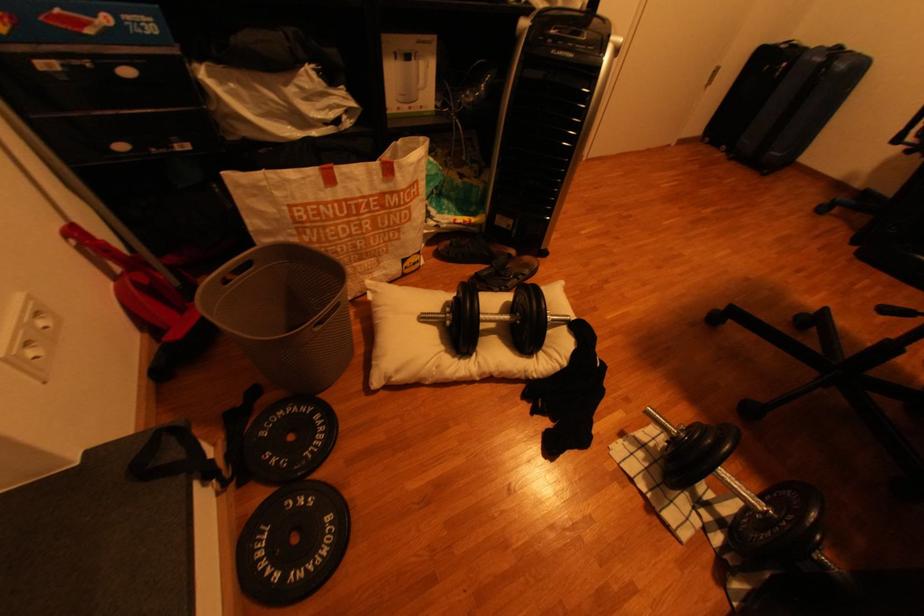
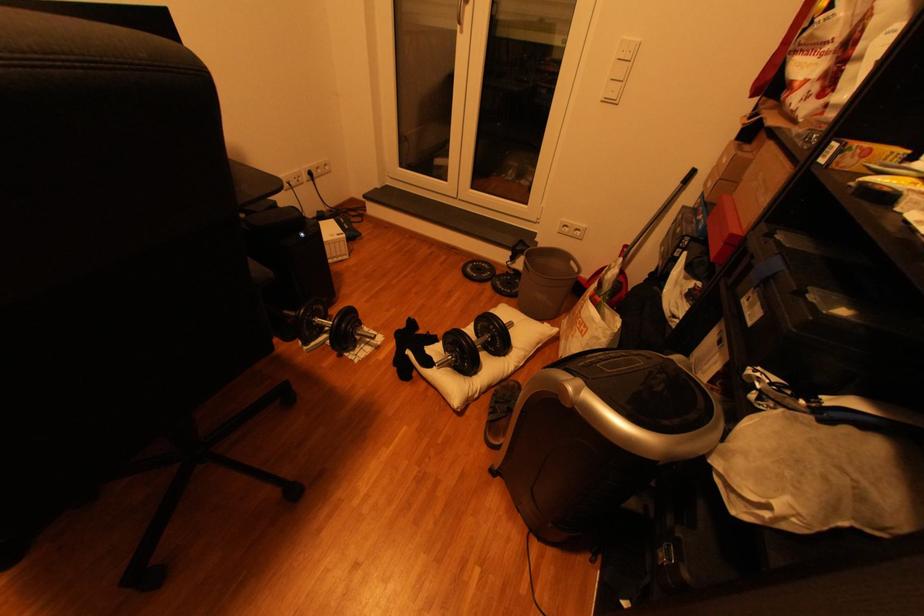
Find the pixel in the second image that matches pixel 518 281 in the first image.

(505, 402)